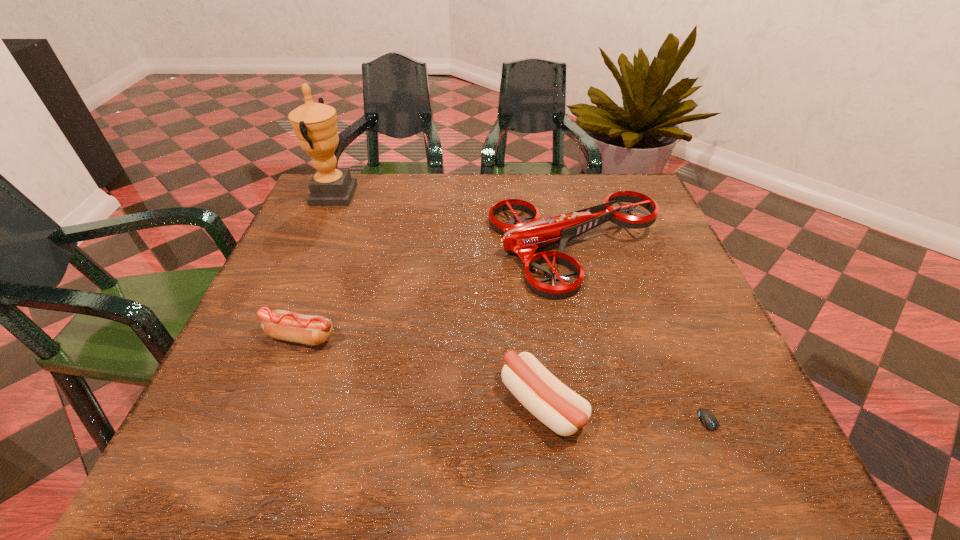
Find the location of `vacant space located 0.200m on the left of the shortest object`. vacant space located 0.200m on the left of the shortest object is located at coordinates (581, 435).

Identify the location of award that is positioned at the far edge. This screenshot has height=540, width=960. (315, 124).

Find the location of a particular element. Image resolution: width=960 pixels, height=540 pixels. drone that is positioned at the far edge is located at coordinates (523, 239).

Identify the location of sausage at the near edge. (561, 409).

I want to click on mouse present at the near edge, so click(x=708, y=419).

This screenshot has width=960, height=540. In order to click on award at the left edge in this screenshot , I will do click(315, 124).

Identify the location of sausage located at the left edge. [x=286, y=325].

The image size is (960, 540). Find the location of `drone located in the right edge section of the desktop`. drone located in the right edge section of the desktop is located at coordinates (523, 239).

This screenshot has width=960, height=540. I want to click on mouse at the right edge, so click(x=708, y=419).

Identify the location of object present at the far left corner. This screenshot has width=960, height=540. (315, 124).